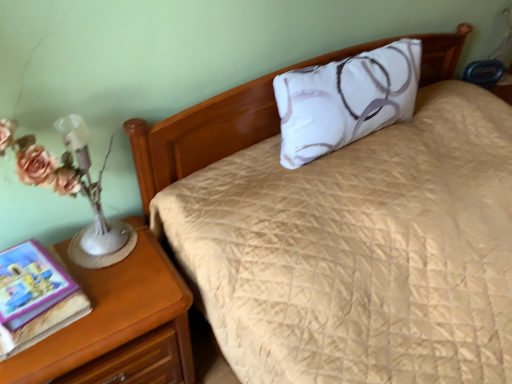
Question: Does white satin pillow at center have a smaller size compared to hardcover book at left?

Choices:
 (A) no
 (B) yes

Answer: (A)

Question: Could you tell me if white satin pillow at center is facing hardcover book at left?

Choices:
 (A) yes
 (B) no

Answer: (B)

Question: Is white satin pillow at center wider than hardcover book at left?

Choices:
 (A) yes
 (B) no

Answer: (B)

Question: From the image's perspective, does white satin pillow at center appear higher than hardcover book at left?

Choices:
 (A) no
 (B) yes

Answer: (B)

Question: From the image's perspective, is white satin pillow at center below hardcover book at left?

Choices:
 (A) yes
 (B) no

Answer: (B)

Question: Can you confirm if white satin pillow at center is taller than hardcover book at left?

Choices:
 (A) yes
 (B) no

Answer: (A)

Question: From a real-world perspective, is hardcover book at left physically below wooden nightstand at lower left?

Choices:
 (A) no
 (B) yes

Answer: (A)

Question: Can you confirm if hardcover book at left is positioned to the right of wooden nightstand at lower left?

Choices:
 (A) yes
 (B) no

Answer: (B)

Question: Does hardcover book at left turn towards wooden nightstand at lower left?

Choices:
 (A) yes
 (B) no

Answer: (B)

Question: Does hardcover book at left have a lesser height compared to wooden nightstand at lower left?

Choices:
 (A) no
 (B) yes

Answer: (B)

Question: From the image's perspective, is hardcover book at left located above wooden nightstand at lower left?

Choices:
 (A) no
 (B) yes

Answer: (B)

Question: From the image's perspective, is hardcover book at left under wooden nightstand at lower left?

Choices:
 (A) no
 (B) yes

Answer: (A)

Question: Is the depth of hardcover book at left greater than that of white satin pillow at center?

Choices:
 (A) yes
 (B) no

Answer: (B)